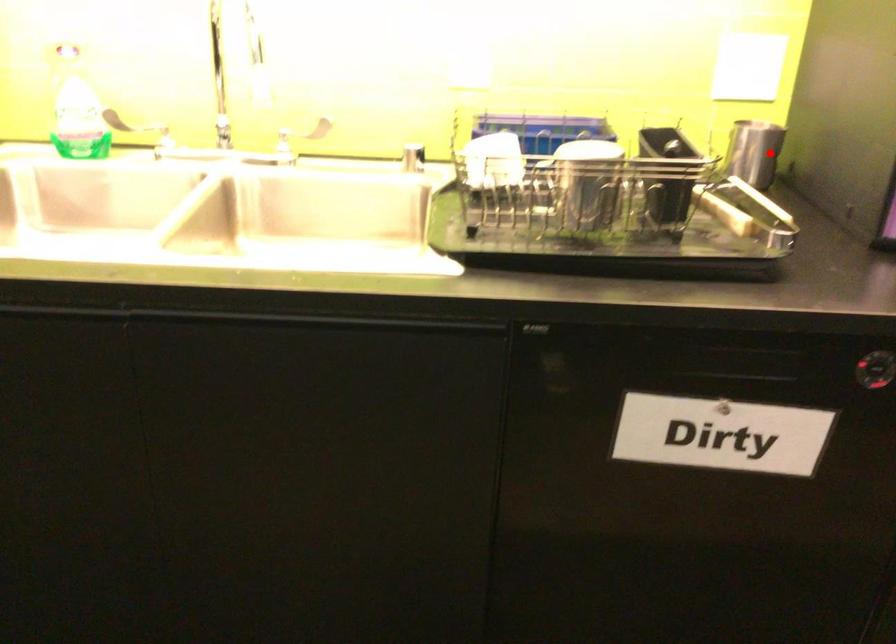
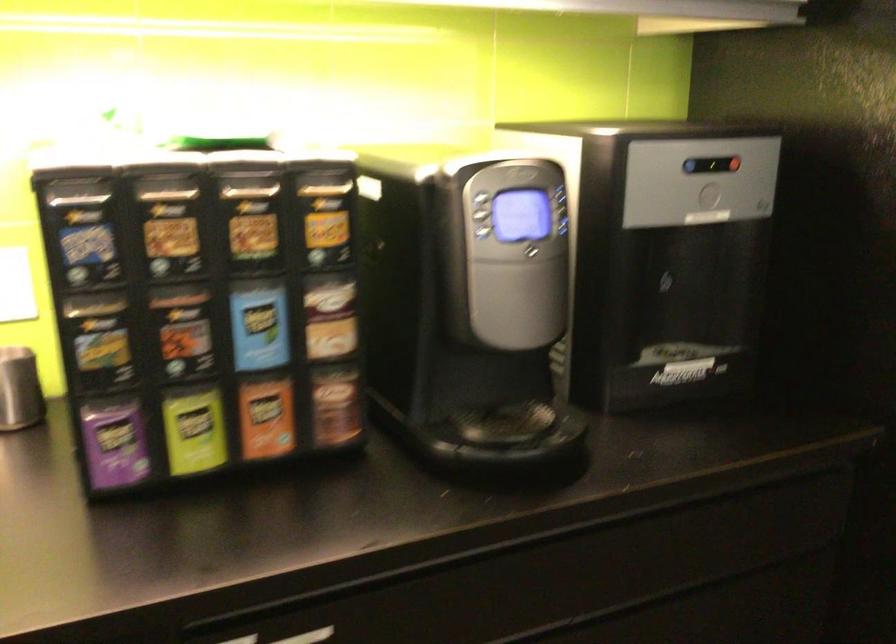
Question: A red point is marked in image1. In image2, is the corresponding 3D point closer to the camera or farther? Reply with the corresponding letter.

Choices:
 (A) The corresponding 3D point is closer.
 (B) The corresponding 3D point is farther.

Answer: (A)